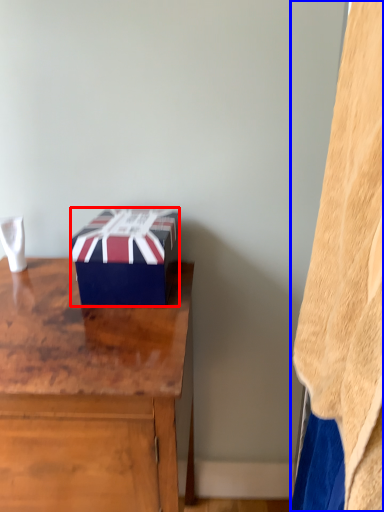
Question: Among these objects, which one is farthest to the camera, box (highlighted by a red box) or blanket (highlighted by a blue box)?

Choices:
 (A) box
 (B) blanket

Answer: (A)